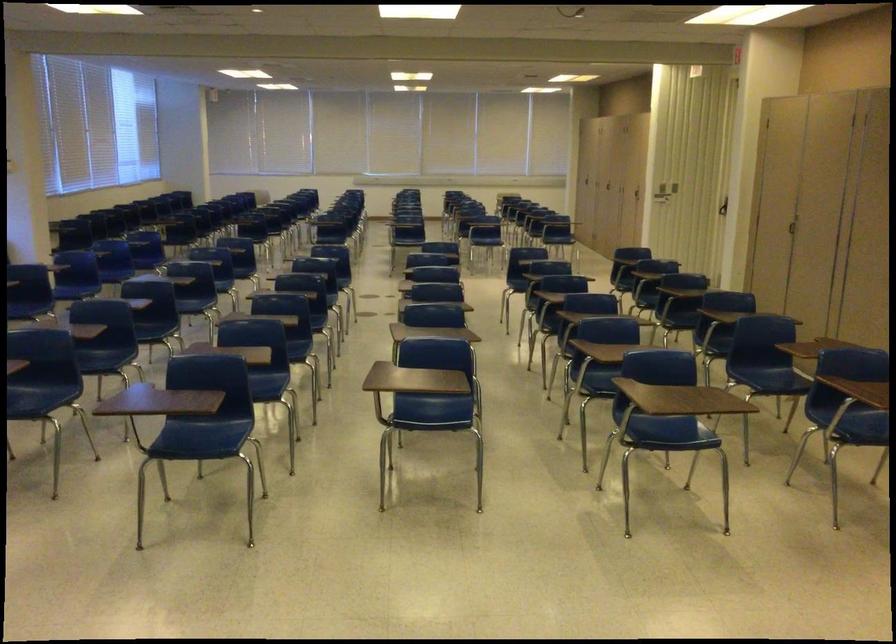
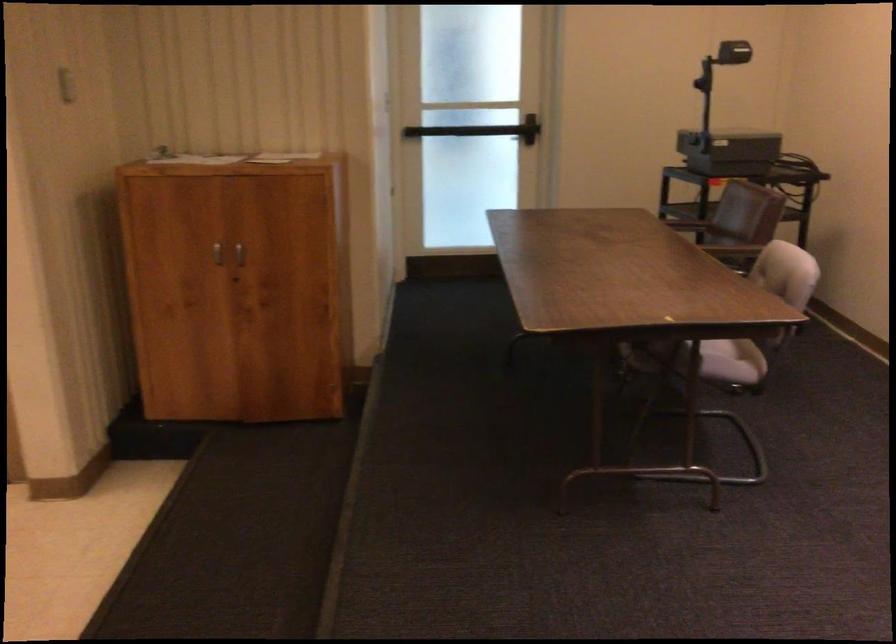
Based on the continuous images, in which direction is the camera rotating?

The camera rotated toward right-down.